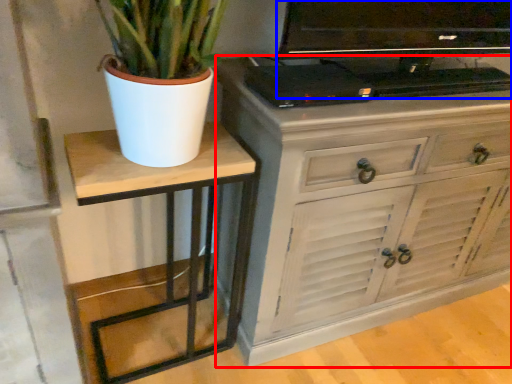
Question: Which object is further to the camera taking this photo, chest of drawers (highlighted by a red box) or television (highlighted by a blue box)?

Choices:
 (A) chest of drawers
 (B) television

Answer: (A)